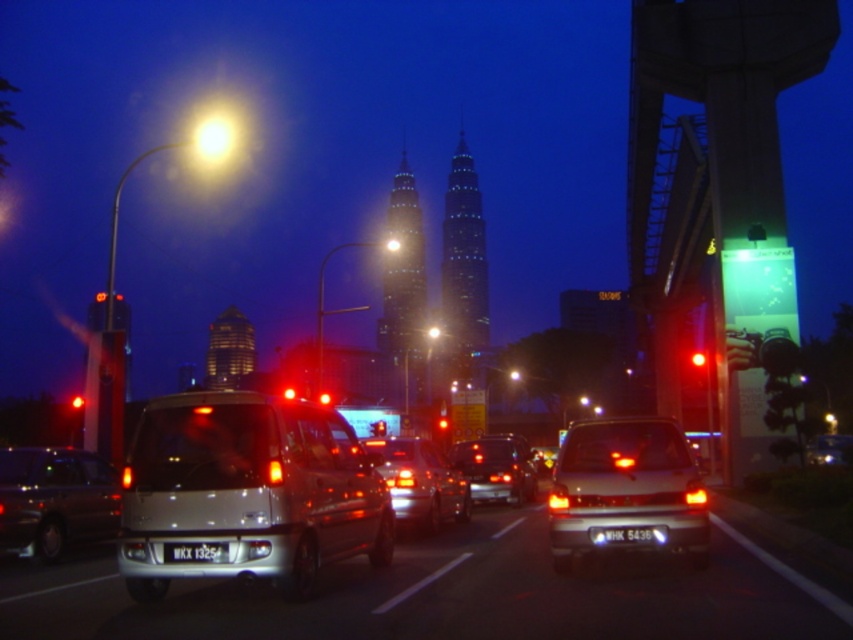
You are a delivery driver in a city with a narrow alley that is 4 meters wide. You need to decide whether your truck can pass between the silver metallic van at center and the shiny silver van at left. Can your truck, which is 4 meters wide, fit through the gap between them?

The gap between the silver metallic van at center and the shiny silver van at left is 4.41 meters, so yes, the truck can fit through the gap since it is wider than the truck.

You are a delivery driver who needs to park your silver metallic van at center in a parking spot that is exactly the same width as the white plastic license plate at center. Will your van fit in the parking spot?

The silver metallic van at center might be wider than the white plastic license plate at center, so it may not fit in the parking spot designed for the license plate width.